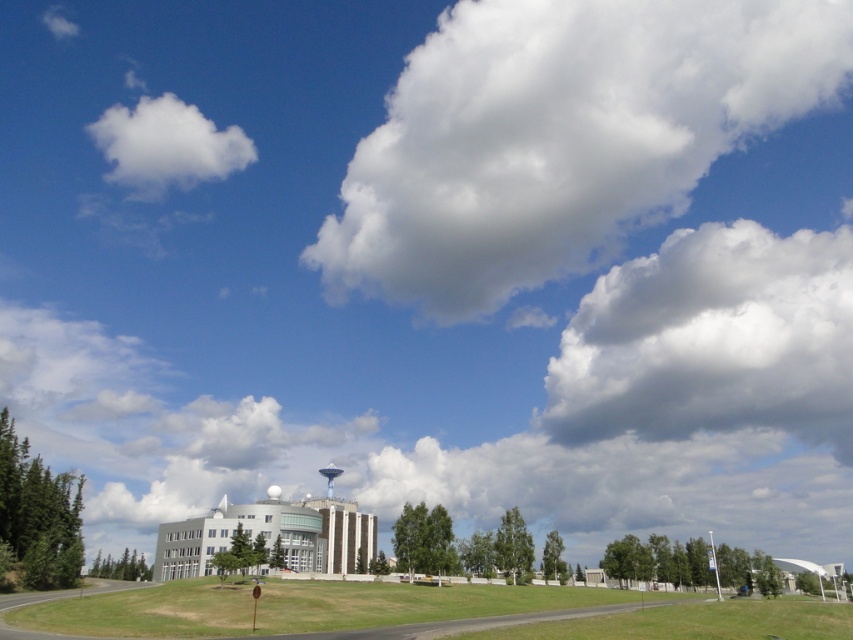
Question: In this image, where is white fluffy cloud at upper center located relative to white fluffy cloud at upper left?

Choices:
 (A) above
 (B) below

Answer: (A)

Question: Among these points, which one is farthest from the camera?

Choices:
 (A) (769, 294)
 (B) (494, 196)

Answer: (A)

Question: Can you confirm if white fluffy cloud at upper right is thinner than white fluffy cloud at upper left?

Choices:
 (A) no
 (B) yes

Answer: (A)

Question: Which point appears farthest from the camera in this image?

Choices:
 (A) (708, 394)
 (B) (480, 288)

Answer: (A)

Question: Which of the following is the farthest from the observer?

Choices:
 (A) white fluffy cloud at upper right
 (B) white fluffy cloud at upper center
 (C) white fluffy cloud at upper left

Answer: (C)

Question: Can you confirm if white fluffy cloud at upper center is wider than white fluffy cloud at upper left?

Choices:
 (A) yes
 (B) no

Answer: (A)